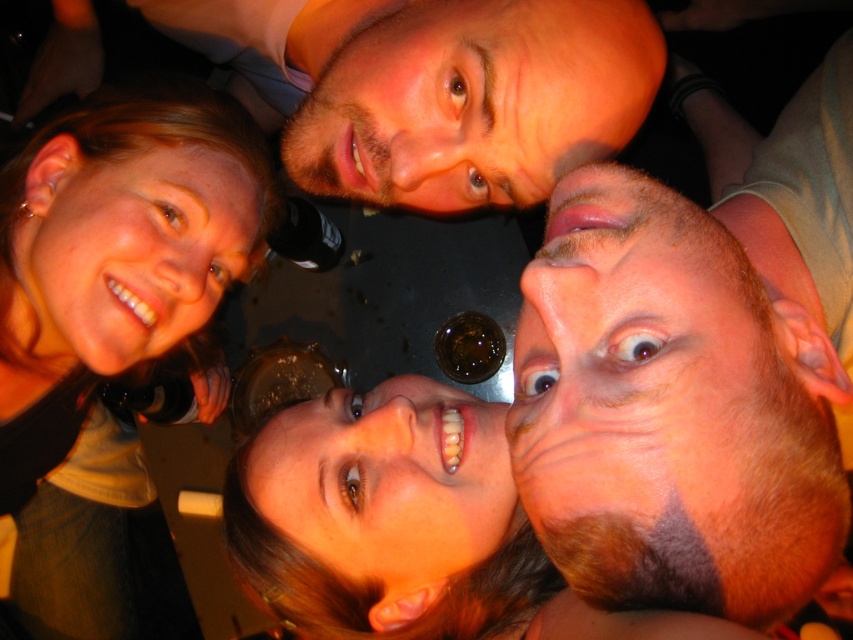
Between point (99, 262) and point (379, 451), which one is positioned behind?

Point (99, 262)

Which is more to the left, matte skin face at upper left or smooth skin face at center?

matte skin face at upper left is more to the left.

The image size is (853, 640). Identify the location of matte skin face at upper left. (129, 250).

Is brown hair at center below matte black hair at upper left?

No.

Who is shorter, brown hair at center or matte black hair at upper left?

brown hair at center

Is point (741, 378) less distant than point (134, 564)?

Yes, it is.

This screenshot has height=640, width=853. What are the coordinates of `brown hair at center` in the screenshot? It's located at (697, 378).

Between point (674, 608) and point (221, 243), which one is positioned in front?

Positioned in front is point (674, 608).

Who is taller, brown hair at center or matte skin face at upper left?

With more height is brown hair at center.

You are a GUI agent. You are given a task and a screenshot of the screen. Output one action in this format:
    pyautogui.click(x=<x>, y=<y>)
    Task: Click on the brown hair at center
    This screenshot has width=853, height=640.
    Given the screenshot: What is the action you would take?
    pyautogui.click(x=697, y=378)